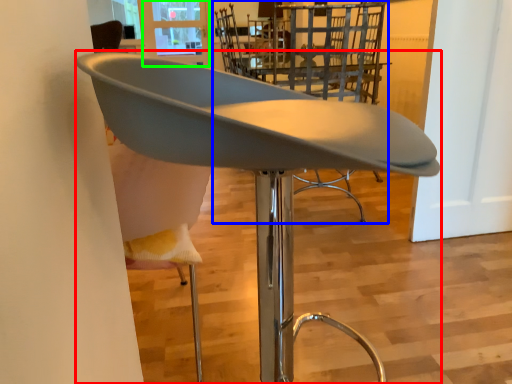
Question: Considering the real-world distances, which object is closest to chair (highlighted by a red box)? chair (highlighted by a blue box) or window screen (highlighted by a green box).

Choices:
 (A) chair
 (B) window screen

Answer: (A)